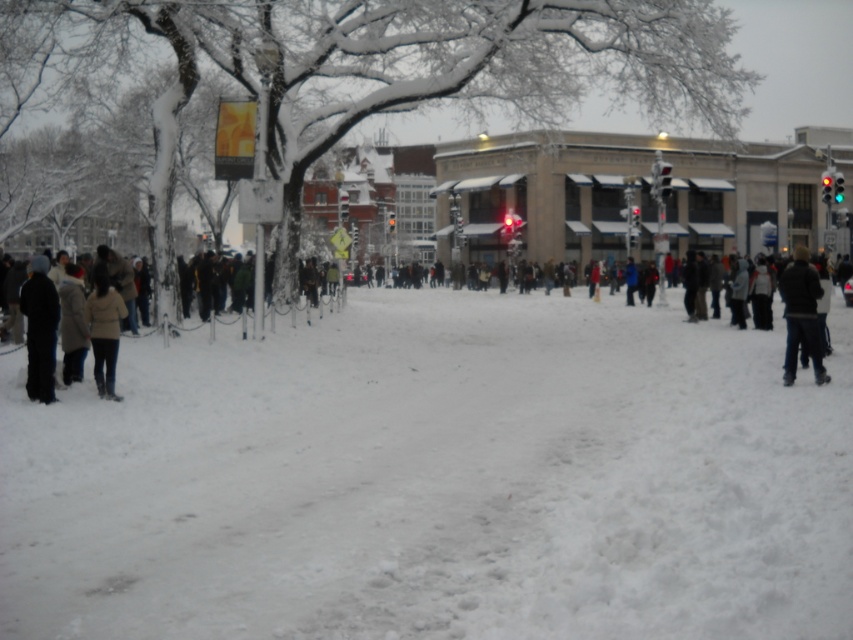
Identify the location of black matte coat at left. This screenshot has height=640, width=853. (39, 330).

Can you confirm if black matte coat at left is shorter than dark blue jacket at right?

Yes.

Locate an element on the screen. The image size is (853, 640). black matte coat at left is located at coordinates (39, 330).

Does dark gray coat at left appear over black matte coat at left?

Incorrect, dark gray coat at left is not positioned above black matte coat at left.

From the picture: Is dark gray coat at left smaller than black matte coat at left?

No.

Where is `dark gray coat at left`? The width and height of the screenshot is (853, 640). dark gray coat at left is located at coordinates (418, 440).

Locate an element on the screen. dark gray coat at left is located at coordinates (418, 440).

Does white fluffy snow at center have a smaller size compared to black matte coat at left?

Incorrect, white fluffy snow at center is not smaller in size than black matte coat at left.

Consider the image. Does white fluffy snow at center have a greater height compared to black matte coat at left?

In fact, white fluffy snow at center may be shorter than black matte coat at left.

Does point (543, 452) come in front of point (26, 387)?

Yes, it is.

Identify the location of white fluffy snow at center. (x=436, y=481).